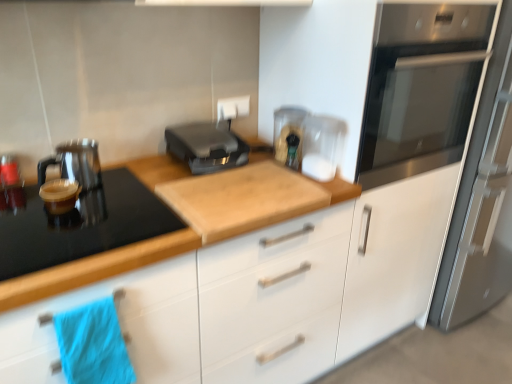
Locate an element on the screen. The height and width of the screenshot is (384, 512). black plastic toaster at center, the 1th kitchen appliance viewed from the right is located at coordinates tap(206, 146).

The image size is (512, 384). What do you see at coordinates (74, 163) in the screenshot? I see `matte black kettle at left, the 1th kitchen appliance when ordered from left to right` at bounding box center [74, 163].

I want to click on blue fabric towel at lower left, so click(93, 344).

You are a GUI agent. You are given a task and a screenshot of the screen. Output one action in this format:
    pyautogui.click(x=<x>, y=<y>)
    Task: Click on the stainless steel oven at upper right
    This screenshot has width=512, height=384.
    Given the screenshot: What is the action you would take?
    421,88

The height and width of the screenshot is (384, 512). I want to click on wooden cutting board at center, so (x=190, y=218).

Considering the sizes of objects wooden cutting board at center and black glass gas stove at left in the image provided, who is shorter, wooden cutting board at center or black glass gas stove at left?

black glass gas stove at left.

Could black glass gas stove at left be considered to be inside wooden cutting board at center?

Yes, wooden cutting board at center contains black glass gas stove at left.

Which is behind, point (207, 203) or point (37, 255)?

The point (207, 203) is more distant.

Is wooden cutting board at center to the right of black glass gas stove at left from the viewer's perspective?

Correct, you'll find wooden cutting board at center to the right of black glass gas stove at left.

From the stainless steel fridge at right, count 1st kitchen appliances forward and point to it. Please provide its 2D coordinates.

[(206, 146)]

Are stainless steel fridge at right and black plastic toaster at center, marked as the 2th kitchen appliance in a left-to-right arrangement, beside each other?

stainless steel fridge at right is not next to black plastic toaster at center, marked as the 2th kitchen appliance in a left-to-right arrangement, and they're not touching.

Is stainless steel fridge at right not within black plastic toaster at center, the 1th kitchen appliance viewed from the right?

Yes, stainless steel fridge at right is not within black plastic toaster at center, the 1th kitchen appliance viewed from the right.

Can we say blue fabric towel at lower left lies outside stainless steel fridge at right?

blue fabric towel at lower left lies outside stainless steel fridge at right's area.

Can you see blue fabric towel at lower left touching stainless steel fridge at right?

No, blue fabric towel at lower left is not next to stainless steel fridge at right.

Is blue fabric towel at lower left thinner than stainless steel fridge at right?

Yes, blue fabric towel at lower left is thinner than stainless steel fridge at right.

This screenshot has height=384, width=512. Find the location of `beach towel lying in front of the stainless steel fridge at right`. beach towel lying in front of the stainless steel fridge at right is located at coordinates (93, 344).

Is wooden cutting board at center inside or outside of white plastic electric outlet at upper center?

wooden cutting board at center is not enclosed by white plastic electric outlet at upper center.

Between point (169, 238) and point (248, 103), which one is positioned in front?

Point (169, 238)

In the image, is wooden cutting board at center on the left side or the right side of white plastic electric outlet at upper center?

Clearly, wooden cutting board at center is on the left of white plastic electric outlet at upper center in the image.

From a real-world perspective, does wooden cutting board at center stand above white plastic electric outlet at upper center?

Incorrect, from a real-world perspective, wooden cutting board at center is lower than white plastic electric outlet at upper center.

From a real-world perspective, is stainless steel oven at upper right physically located above or below matte black kettle at left, which is the 2th kitchen appliance in right-to-left order?

From a real-world perspective, stainless steel oven at upper right is physically above matte black kettle at left, which is the 2th kitchen appliance in right-to-left order.

From the image's perspective, which one is positioned lower, stainless steel oven at upper right or matte black kettle at left, the 1th kitchen appliance when ordered from left to right?

matte black kettle at left, the 1th kitchen appliance when ordered from left to right, appears lower in the image.

Is there a large distance between stainless steel oven at upper right and matte black kettle at left, the 1th kitchen appliance when ordered from left to right?

Yes, stainless steel oven at upper right is far from matte black kettle at left, the 1th kitchen appliance when ordered from left to right.

Is point (471, 99) positioned in front of point (87, 176)?

No, it is behind (87, 176).

Is stainless steel fridge at right shorter than blue fabric towel at lower left?

Incorrect, the height of stainless steel fridge at right does not fall short of that of blue fabric towel at lower left.

Considering the positions of point (506, 24) and point (91, 304), is point (506, 24) closer or farther from the camera than point (91, 304)?

Point (506, 24) is farther from the camera than point (91, 304).

Could you tell me if stainless steel fridge at right is facing blue fabric towel at lower left?

No.

From a real-world perspective, is stainless steel fridge at right positioned over blue fabric towel at lower left based on gravity?

Yes, from a real-world perspective, stainless steel fridge at right is above blue fabric towel at lower left.

Is blue fabric towel at lower left inside wooden cutting board at center?

Yes, blue fabric towel at lower left is a part of wooden cutting board at center.

Does point (284, 193) come closer to viewer compared to point (87, 311)?

No, (284, 193) is further to viewer.

Is wooden cutting board at center taller or shorter than blue fabric towel at lower left?

In the image, wooden cutting board at center appears to be taller than blue fabric towel at lower left.

Find the location of a particular element. countertop located below the black glass gas stove at left (from the image's perspective) is located at coordinates (190, 218).

At what (x,y) coordinates should I click in order to perform the action: click on fridge on the right of black plastic toaster at center, marked as the 2th kitchen appliance in a left-to-right arrangement. Please return your answer as a coordinate pair (x, y). Image resolution: width=512 pixels, height=384 pixels. Looking at the image, I should click on (481, 202).

When comparing their distances from white plastic electric outlet at upper center, does black glass gas stove at left or stainless steel fridge at right seem closer?

black glass gas stove at left is closer to white plastic electric outlet at upper center.

From the image, which object appears to be nearer to black glass gas stove at left, wooden cutting board at center or stainless steel oven at upper right?

Based on the image, wooden cutting board at center appears to be nearer to black glass gas stove at left.

Estimate the real-world distances between objects in this image. Which object is further from black plastic toaster at center, the 1th kitchen appliance viewed from the right, wooden cutting board at center or black glass gas stove at left?

black glass gas stove at left is further to black plastic toaster at center, the 1th kitchen appliance viewed from the right.

When comparing their distances from blue fabric towel at lower left, does stainless steel oven at upper right or black plastic toaster at center, marked as the 2th kitchen appliance in a left-to-right arrangement, seem further?

stainless steel oven at upper right is further to blue fabric towel at lower left.

Based on their spatial positions, is stainless steel oven at upper right or wooden cutting board at center further from matte black kettle at left, the 1th kitchen appliance when ordered from left to right?

stainless steel oven at upper right is further to matte black kettle at left, the 1th kitchen appliance when ordered from left to right.

Based on their spatial positions, is white plastic electric outlet at upper center or black glass gas stove at left closer to matte black kettle at left, the 1th kitchen appliance when ordered from left to right?

black glass gas stove at left is closer to matte black kettle at left, the 1th kitchen appliance when ordered from left to right.

Estimate the real-world distances between objects in this image. Which object is further from matte black kettle at left, which is the 2th kitchen appliance in right-to-left order, black glass gas stove at left or blue fabric towel at lower left?

blue fabric towel at lower left is positioned further to the anchor matte black kettle at left, which is the 2th kitchen appliance in right-to-left order.

Which object lies further to the anchor point matte black kettle at left, the 1th kitchen appliance when ordered from left to right, black glass gas stove at left or stainless steel fridge at right?

stainless steel fridge at right lies further to matte black kettle at left, the 1th kitchen appliance when ordered from left to right, than the other object.

Find the location of a particular element. gas stove between black plastic toaster at center, marked as the 2th kitchen appliance in a left-to-right arrangement, and blue fabric towel at lower left vertically is located at coordinates (79, 224).

Locate an element on the screen. This screenshot has width=512, height=384. kitchen appliance located between matte black kettle at left, which is the 2th kitchen appliance in right-to-left order, and stainless steel fridge at right in the left-right direction is located at coordinates (206, 146).

You are a GUI agent. You are given a task and a screenshot of the screen. Output one action in this format:
    pyautogui.click(x=<x>, y=<y>)
    Task: Click on the kitchen appliance between black plastic toaster at center, the 1th kitchen appliance viewed from the right, and wooden cutting board at center from top to bottom
    This screenshot has height=384, width=512.
    Given the screenshot: What is the action you would take?
    pyautogui.click(x=74, y=163)

Where is `kitchen appliance between matte black kettle at left, which is the 2th kitchen appliance in right-to-left order, and stainless steel oven at upper right, in the horizontal direction`? The width and height of the screenshot is (512, 384). kitchen appliance between matte black kettle at left, which is the 2th kitchen appliance in right-to-left order, and stainless steel oven at upper right, in the horizontal direction is located at coordinates coord(206,146).